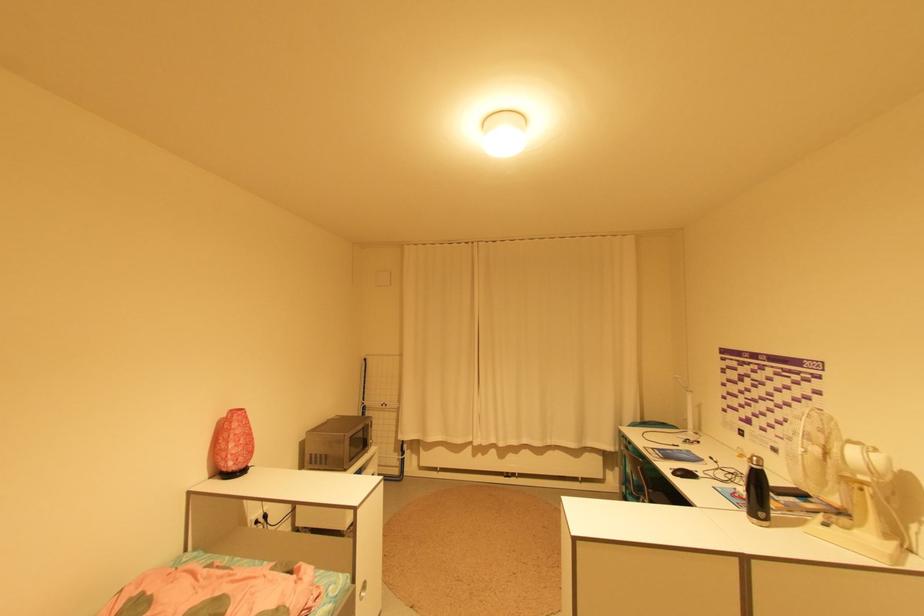
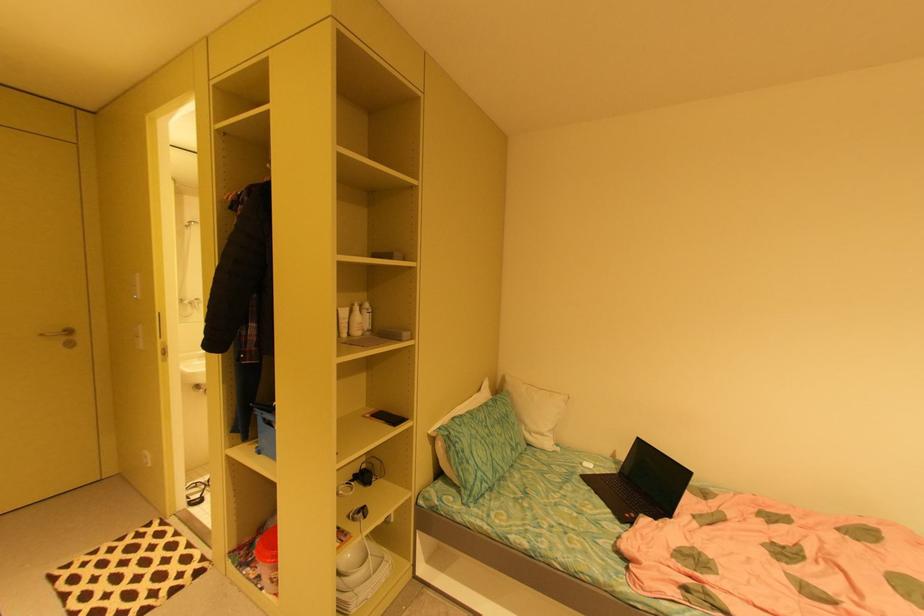
Question: The camera is either moving clockwise (left) or counter-clockwise (right) around the object. The first image is from the beginning of the video and the second image is from the end. Is the camera moving left or right when shooting the video?

Choices:
 (A) Left
 (B) Right

Answer: (B)